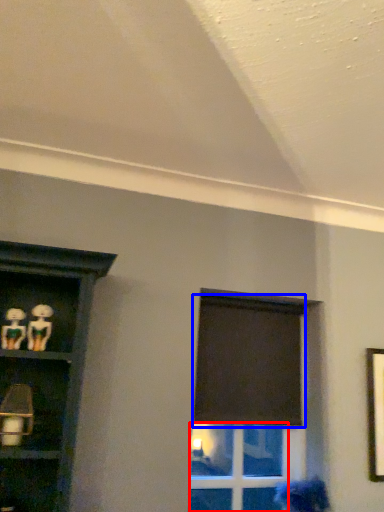
Question: Which of the following is the closest to the observer, glass door (highlighted by a red box) or curtain (highlighted by a blue box)?

Choices:
 (A) glass door
 (B) curtain

Answer: (A)